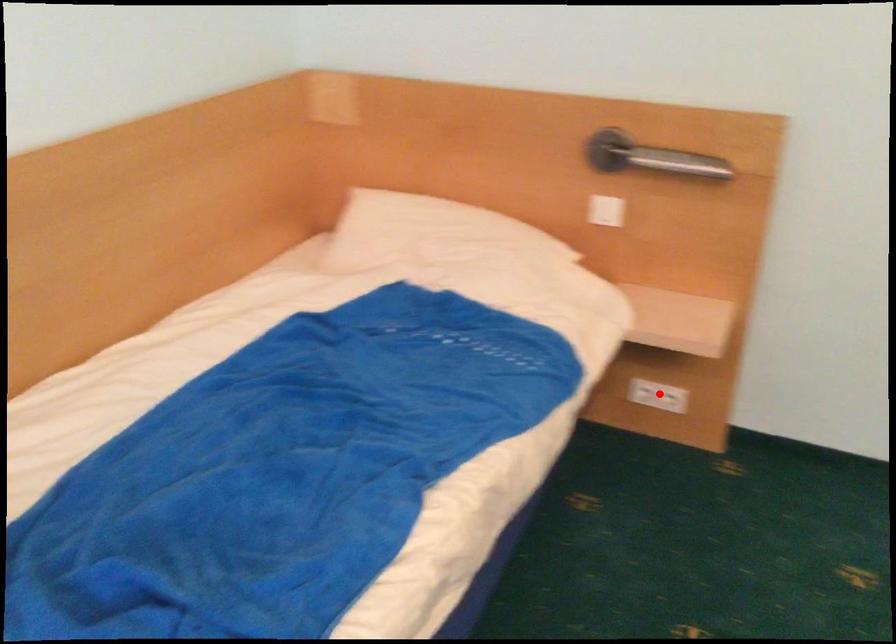
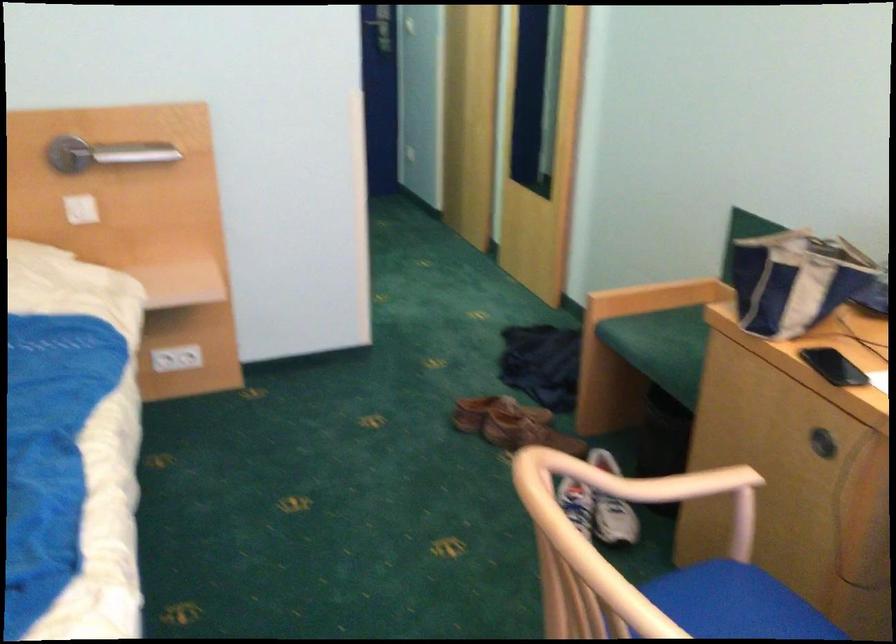
In the second image, find the point that corresponds to the highlighted location in the first image.

(176, 359)